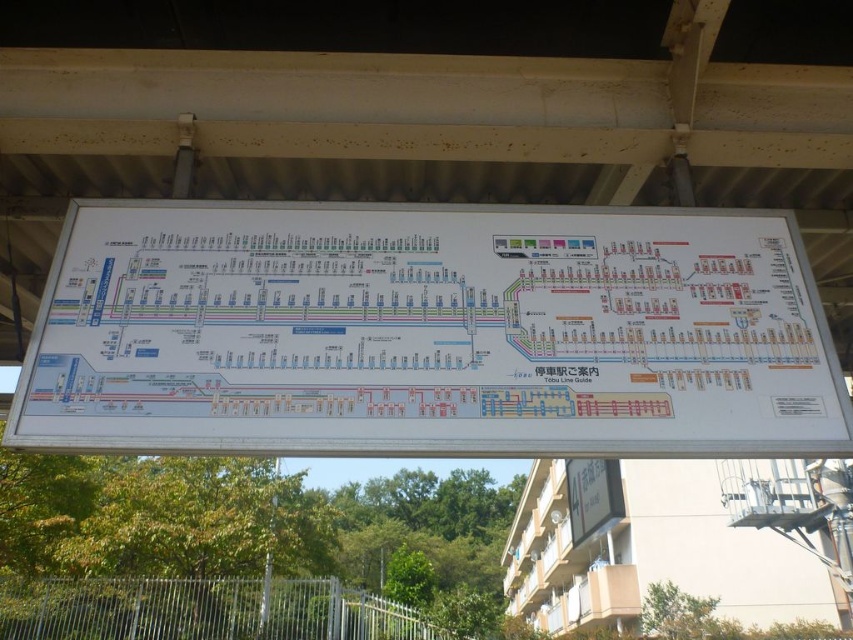
You are a traveler looking at the white paper map at center and the white paper signboard at center. Which one is positioned to the left side?

The white paper map at center is positioned to the left of the white paper signboard at center.

You are a traveler holding a white paper map at center and standing in front of a white paper signboard at center. Can you see the entire signboard behind the map?

The white paper map at center is in front of the white paper signboard at center, so the map is blocking part of the signboard. Therefore, you cannot see the entire signboard behind the map.